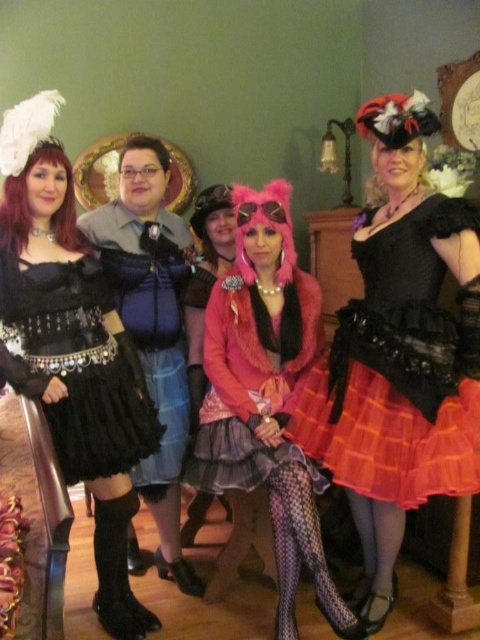
Is point (60, 173) closer to viewer compared to point (55, 300)?

No.

Does point (83, 444) come closer to viewer compared to point (26, 266)?

No, (83, 444) is further to viewer.

Identify the location of matte black dress at left. The width and height of the screenshot is (480, 640). (72, 348).

Is matte black dress at left behind orange plaid skirt at center?

No, matte black dress at left is closer to the viewer.

Is matte black dress at left smaller than orange plaid skirt at center?

Incorrect, matte black dress at left is not smaller in size than orange plaid skirt at center.

I want to click on matte black dress at left, so pos(72,348).

I want to click on matte black dress at left, so click(x=72, y=348).

Is point (243, 257) positioned after point (148, 246)?

No, it is in front of (148, 246).

Is fuzzy pink jacket at center thinner than matte blue fabric at center?

No, fuzzy pink jacket at center is not thinner than matte blue fabric at center.

Is point (285, 547) farther from viewer compared to point (153, 278)?

No.

Locate an element on the screen. fuzzy pink jacket at center is located at coordinates (266, 396).